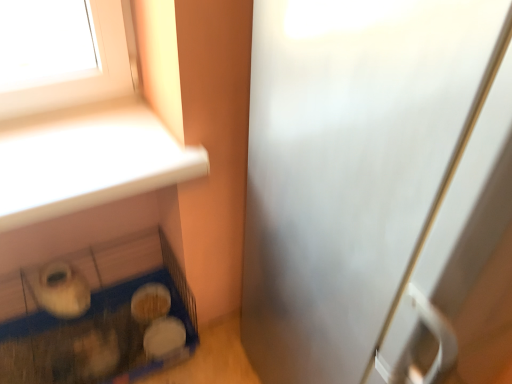
What do you see at coordinates (150, 302) in the screenshot? I see `white matte food at lower left, which is the second food from bottom to top` at bounding box center [150, 302].

What do you see at coordinates (94, 318) in the screenshot? The image size is (512, 384). I see `blue plastic bird cage at lower left` at bounding box center [94, 318].

What do you see at coordinates (164, 338) in the screenshot?
I see `white matte bowl at lower center, arranged as the 1th food when ordered from the bottom` at bounding box center [164, 338].

Locate an element on the screen. Image resolution: width=512 pixels, height=384 pixels. white matte food at lower left, which is counted as the 1th food, starting from the top is located at coordinates (150, 302).

Does point (284, 246) appear closer or farther from the camera than point (147, 314)?

Clearly, point (284, 246) is closer to the camera than point (147, 314).

Which object is closer to the camera, satin silver screen door at right or white matte food at lower left, which is the second food from bottom to top?

satin silver screen door at right is closer to the camera.

From a real-world perspective, count 1st foods downward from the satin silver screen door at right and point to it. Please provide its 2D coordinates.

[(150, 302)]

Considering the relative positions of satin silver screen door at right and white matte food at lower left, which is counted as the 1th food, starting from the top, in the image provided, is satin silver screen door at right to the left or to the right of white matte food at lower left, which is counted as the 1th food, starting from the top,?

From the image, it's evident that satin silver screen door at right is to the right of white matte food at lower left, which is counted as the 1th food, starting from the top.

From the image's perspective, which one is positioned lower, white matte food at lower left, which is the second food from bottom to top, or white matte bowl at lower center, which is the second food from top to bottom?

white matte bowl at lower center, which is the second food from top to bottom, appears lower in the image.

Which is nearer, [136,290] or [174,345]?

The point [174,345] is closer to the camera.

At what (x,y) coordinates should I click in order to perform the action: click on food that is on the left side of white matte bowl at lower center, arranged as the 1th food when ordered from the bottom. Please return your answer as a coordinate pair (x, y). The image size is (512, 384). Looking at the image, I should click on (150, 302).

Is white matte bowl at lower center, which is the second food from top to bottom, wider or thinner than blue plastic bird cage at lower left?

white matte bowl at lower center, which is the second food from top to bottom, is thinner than blue plastic bird cage at lower left.

Between white matte bowl at lower center, arranged as the 1th food when ordered from the bottom, and blue plastic bird cage at lower left, which one has larger size?

Bigger between the two is blue plastic bird cage at lower left.

From their relative heights in the image, would you say white matte bowl at lower center, arranged as the 1th food when ordered from the bottom, is taller or shorter than blue plastic bird cage at lower left?

Considering their sizes, white matte bowl at lower center, arranged as the 1th food when ordered from the bottom, has less height than blue plastic bird cage at lower left.

Does white matte bowl at lower center, which is the second food from top to bottom, turn towards blue plastic bird cage at lower left?

Yes, white matte bowl at lower center, which is the second food from top to bottom, is oriented towards blue plastic bird cage at lower left.

Does satin silver screen door at right contain blue plastic bird cage at lower left?

No, blue plastic bird cage at lower left is not a part of satin silver screen door at right.

Which of these two, satin silver screen door at right or blue plastic bird cage at lower left, stands taller?

satin silver screen door at right is taller.

Which object is more forward, satin silver screen door at right or blue plastic bird cage at lower left?

satin silver screen door at right.

Is satin silver screen door at right directly adjacent to blue plastic bird cage at lower left?

No, satin silver screen door at right is not touching blue plastic bird cage at lower left.

Can you confirm if blue plastic bird cage at lower left is positioned to the right of white matte food at lower left, which is counted as the 1th food, starting from the top?

In fact, blue plastic bird cage at lower left is to the left of white matte food at lower left, which is counted as the 1th food, starting from the top.

Measure the distance from blue plastic bird cage at lower left to white matte food at lower left, which is the second food from bottom to top.

The distance of blue plastic bird cage at lower left from white matte food at lower left, which is the second food from bottom to top, is 7.78 inches.

From a real-world perspective, who is located higher, blue plastic bird cage at lower left or white matte food at lower left, which is the second food from bottom to top?

In real-world perspective, blue plastic bird cage at lower left is above.

Is blue plastic bird cage at lower left turned away from white matte food at lower left, which is the second food from bottom to top?

Yes, blue plastic bird cage at lower left is facing away from white matte food at lower left, which is the second food from bottom to top.

Is point (132, 307) closer or farther from the camera than point (317, 53)?

Point (132, 307) is positioned farther from the camera compared to point (317, 53).

From the image's perspective, would you say white matte food at lower left, which is counted as the 1th food, starting from the top, is positioned over satin silver screen door at right?

No, from the image's perspective, white matte food at lower left, which is counted as the 1th food, starting from the top, is not on top of satin silver screen door at right.

Considering the positions of objects white matte food at lower left, which is the second food from bottom to top, and satin silver screen door at right in the image provided, who is in front, white matte food at lower left, which is the second food from bottom to top, or satin silver screen door at right?

satin silver screen door at right is closer to the camera.

There is a satin silver screen door at right. Where is `the 1st food below it (from a real-world perspective)`? This screenshot has width=512, height=384. the 1st food below it (from a real-world perspective) is located at coordinates (150, 302).

The width and height of the screenshot is (512, 384). There is a white matte bowl at lower center, arranged as the 1th food when ordered from the bottom. Find the location of `screen door above it (from a real-world perspective)`. screen door above it (from a real-world perspective) is located at coordinates (351, 168).

From the image's perspective, which is above, white matte bowl at lower center, arranged as the 1th food when ordered from the bottom, or satin silver screen door at right?

satin silver screen door at right is shown above in the image.

Is white matte bowl at lower center, arranged as the 1th food when ordered from the bottom, oriented away from satin silver screen door at right?

white matte bowl at lower center, arranged as the 1th food when ordered from the bottom, is not turned away from satin silver screen door at right.

How distant is white matte bowl at lower center, which is the second food from top to bottom, from satin silver screen door at right?

white matte bowl at lower center, which is the second food from top to bottom, is 36.98 inches from satin silver screen door at right.

In the image, there is a white matte food at lower left, which is the second food from bottom to top. Where is `screen door above it (from the image's perspective)`? screen door above it (from the image's perspective) is located at coordinates (351, 168).

This screenshot has width=512, height=384. In order to click on food below the white matte food at lower left, which is the second food from bottom to top (from a real-world perspective) in this screenshot , I will do `click(164, 338)`.

From the image, which object appears to be nearer to blue plastic bird cage at lower left, white matte bowl at lower center, which is the second food from top to bottom, or white matte food at lower left, which is counted as the 1th food, starting from the top?

The object closer to blue plastic bird cage at lower left is white matte food at lower left, which is counted as the 1th food, starting from the top.

Based on their spatial positions, is blue plastic bird cage at lower left or satin silver screen door at right further from white matte bowl at lower center, arranged as the 1th food when ordered from the bottom?

satin silver screen door at right is further to white matte bowl at lower center, arranged as the 1th food when ordered from the bottom.

When comparing their distances from white matte food at lower left, which is counted as the 1th food, starting from the top, does blue plastic bird cage at lower left or white matte bowl at lower center, which is the second food from top to bottom, seem further?

Based on the image, blue plastic bird cage at lower left appears to be further to white matte food at lower left, which is counted as the 1th food, starting from the top.

When comparing their distances from white matte bowl at lower center, which is the second food from top to bottom, does satin silver screen door at right or blue plastic bird cage at lower left seem further?

satin silver screen door at right lies further to white matte bowl at lower center, which is the second food from top to bottom, than the other object.

Estimate the real-world distances between objects in this image. Which object is further from satin silver screen door at right, blue plastic bird cage at lower left or white matte bowl at lower center, which is the second food from top to bottom?

white matte bowl at lower center, which is the second food from top to bottom.

Looking at the image, which one is located further to satin silver screen door at right, white matte bowl at lower center, which is the second food from top to bottom, or blue plastic bird cage at lower left?

white matte bowl at lower center, which is the second food from top to bottom, lies further to satin silver screen door at right than the other object.

Considering their positions, is white matte food at lower left, which is the second food from bottom to top, positioned closer to satin silver screen door at right than white matte bowl at lower center, arranged as the 1th food when ordered from the bottom?

white matte bowl at lower center, arranged as the 1th food when ordered from the bottom.

Consider the image. Looking at the image, which one is located further to white matte food at lower left, which is the second food from bottom to top, white matte bowl at lower center, arranged as the 1th food when ordered from the bottom, or blue plastic bird cage at lower left?

The object further to white matte food at lower left, which is the second food from bottom to top, is blue plastic bird cage at lower left.

This screenshot has height=384, width=512. I want to click on bird cage between satin silver screen door at right and white matte food at lower left, which is the second food from bottom to top, along the z-axis, so click(x=94, y=318).

Find the location of a particular element. food positioned between blue plastic bird cage at lower left and white matte food at lower left, which is counted as the 1th food, starting from the top, from near to far is located at coordinates (164, 338).

In order to click on food positioned between satin silver screen door at right and white matte food at lower left, which is the second food from bottom to top, from near to far in this screenshot , I will do `click(164, 338)`.

The height and width of the screenshot is (384, 512). Find the location of `bird cage between satin silver screen door at right and white matte bowl at lower center, arranged as the 1th food when ordered from the bottom, from front to back`. bird cage between satin silver screen door at right and white matte bowl at lower center, arranged as the 1th food when ordered from the bottom, from front to back is located at coordinates (94, 318).